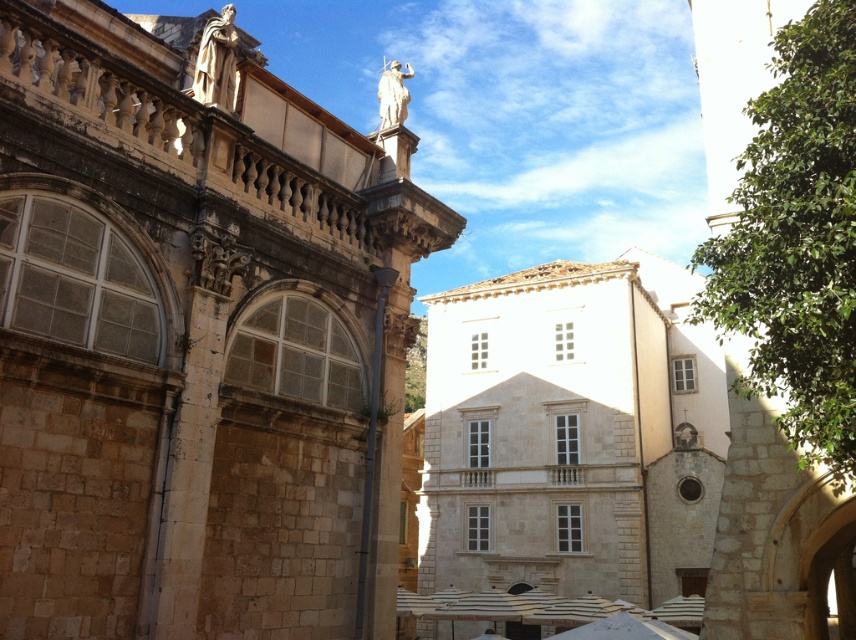
Question: Does white marble statue at upper left have a lesser width compared to white marble statue at upper center?

Choices:
 (A) no
 (B) yes

Answer: (B)

Question: Is white marble statue at upper left thinner than white marble statue at upper center?

Choices:
 (A) no
 (B) yes

Answer: (B)

Question: Which object is closer to the camera taking this photo?

Choices:
 (A) white marble statue at upper center
 (B) white marble statue at upper left

Answer: (B)

Question: Does white marble statue at upper left have a lesser width compared to white marble statue at upper center?

Choices:
 (A) no
 (B) yes

Answer: (B)

Question: Which point appears farthest from the camera in this image?

Choices:
 (A) (379, 140)
 (B) (229, 29)

Answer: (A)

Question: Which point is closer to the camera?

Choices:
 (A) (217, 54)
 (B) (381, 72)

Answer: (A)